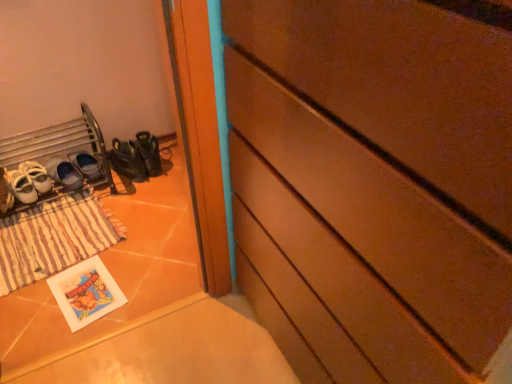
Find the location of a particular element. Image resolution: width=512 pixels, height=384 pixels. free location in front of matte black shoes at lower left, which is counted as the 4th footwear, starting from the left is located at coordinates (127, 192).